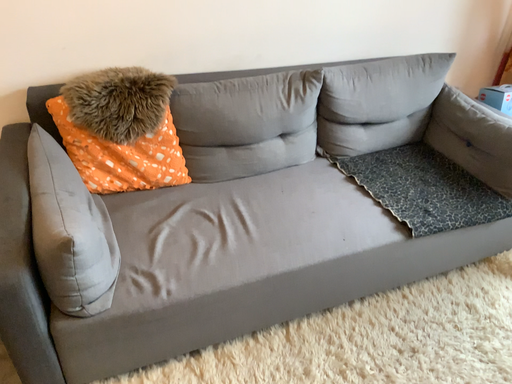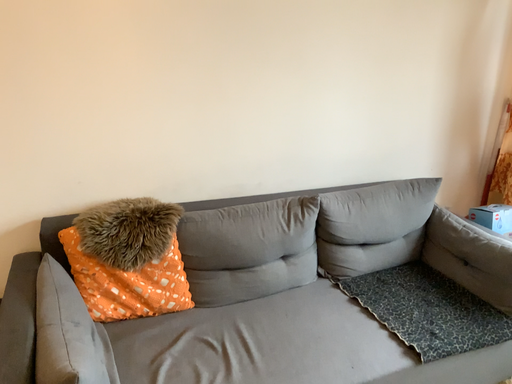
Question: Which way did the camera rotate in the video?

Choices:
 (A) rotated downward
 (B) rotated upward

Answer: (B)